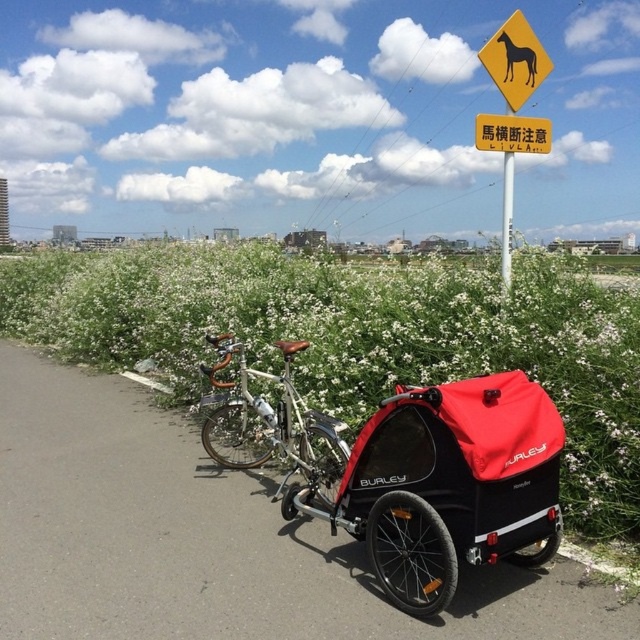
You are a hiker who wants to know which object is higher between the yellow plastic horse at upper center and the white plastic pole at center. According to the scene, which one is higher?

The yellow plastic horse at upper center is located above the white plastic pole at center, so it is higher.

You are planning to store both the red matte baby carriage at lower right and the silver metallic bicycle at center in a storage room. The storage room has limited space. Based on the scene, which item would require more storage space and why?

The silver metallic bicycle at center requires more storage space because the red matte baby carriage at lower right occupies less space than it.

You are a parent holding a baby and want to place the baby in the closest available object. Which object should you choose between the red matte baby carriage at lower right and the silver metallic bicycle at center?

The red matte baby carriage at lower right is below the silver metallic bicycle at center, so the red matte baby carriage at lower right is closer to you and should be chosen to place the baby.